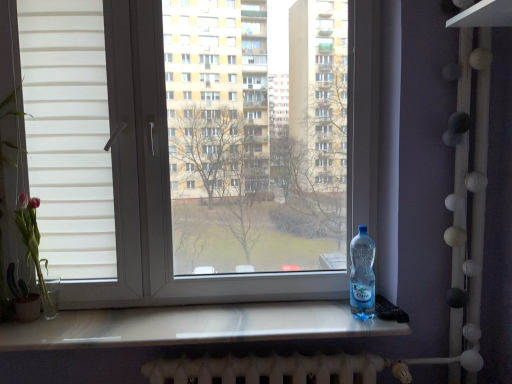
Identify the location of transparent plastic window at center. (161, 190).

This screenshot has width=512, height=384. What do you see at coordinates (362, 275) in the screenshot?
I see `transparent plastic bottle at right` at bounding box center [362, 275].

This screenshot has width=512, height=384. I want to click on pink glass vase at left, so click(35, 249).

Considering the points (367, 312) and (134, 214), which point is in front, point (367, 312) or point (134, 214)?

Positioned in front is point (367, 312).

From a real-world perspective, is transparent plastic bottle at right on transparent plastic window at center?

No.

Considering the relative positions of transparent plastic bottle at right and transparent plastic window at center in the image provided, is transparent plastic bottle at right to the left or to the right of transparent plastic window at center?

transparent plastic bottle at right is positioned on transparent plastic window at center's right side.

Would you consider transparent plastic window at center to be distant from transparent plastic bottle at right?

No, transparent plastic window at center is not far from transparent plastic bottle at right.

Between point (111, 56) and point (362, 233), which one is positioned behind?

The point (111, 56) is more distant.

Measure the distance from transparent plastic window at center to transparent plastic bottle at right.

transparent plastic window at center and transparent plastic bottle at right are 44.40 centimeters apart from each other.

Between transparent plastic window at center and transparent plastic bottle at right, which one has larger width?

transparent plastic bottle at right is wider.

Would you say pink glass vase at left is to the left or to the right of transparent plastic window at center in the picture?

From the image, it's evident that pink glass vase at left is to the left of transparent plastic window at center.

Consider the image. Is pink glass vase at left placed right next to transparent plastic window at center?

pink glass vase at left is not next to transparent plastic window at center, and they're not touching.

Considering the positions of point (47, 307) and point (123, 152), is point (47, 307) closer or farther from the camera than point (123, 152)?

Point (47, 307) is positioned farther from the camera compared to point (123, 152).

Between pink glass vase at left and transparent plastic window at center, which one has smaller width?

Thinner between the two is transparent plastic window at center.

How far apart are transparent plastic bottle at right and pink glass vase at left?

transparent plastic bottle at right is 3.87 feet from pink glass vase at left.

Which is more to the left, transparent plastic bottle at right or pink glass vase at left?

From the viewer's perspective, pink glass vase at left appears more on the left side.

Is transparent plastic bottle at right closer to camera compared to pink glass vase at left?

Yes, transparent plastic bottle at right is closer to the viewer.

Does pink glass vase at left turn towards transparent plastic bottle at right?

No, pink glass vase at left is not turned towards transparent plastic bottle at right.

Identify the location of bottle on the right of pink glass vase at left. Image resolution: width=512 pixels, height=384 pixels. (362, 275).

Looking at this image, from the image's perspective, is pink glass vase at left on top of transparent plastic bottle at right?

Yes, from the image's perspective, pink glass vase at left is above transparent plastic bottle at right.

Considering their positions, is pink glass vase at left located in front of or behind transparent plastic bottle at right?

pink glass vase at left is positioned farther from the viewer than transparent plastic bottle at right.

From the image's perspective, is transparent plastic window at center positioned above or below pink glass vase at left?

From the image's perspective, transparent plastic window at center appears above pink glass vase at left.

Is transparent plastic window at center taller or shorter than pink glass vase at left?

→ In the image, transparent plastic window at center appears to be taller than pink glass vase at left.

This screenshot has width=512, height=384. In order to click on window that is above the pink glass vase at left (from the image's perspective) in this screenshot , I will do `click(161, 190)`.

Is transparent plastic window at center aimed at pink glass vase at left?

Yes, transparent plastic window at center faces towards pink glass vase at left.

Locate an element on the screen. The image size is (512, 384). window in front of the transparent plastic bottle at right is located at coordinates (161, 190).

Locate an element on the screen. This screenshot has width=512, height=384. bottle below the transparent plastic window at center (from the image's perspective) is located at coordinates (362, 275).

Considering their positions, is transparent plastic bottle at right positioned closer to pink glass vase at left than transparent plastic window at center?

Among the two, transparent plastic window at center is located nearer to pink glass vase at left.

Based on their spatial positions, is transparent plastic window at center or transparent plastic bottle at right further from pink glass vase at left?

transparent plastic bottle at right lies further to pink glass vase at left than the other object.

Considering their positions, is pink glass vase at left positioned further to transparent plastic window at center than transparent plastic bottle at right?

pink glass vase at left is positioned further to the anchor transparent plastic window at center.

From the image, which object appears to be farther from transparent plastic bottle at right, transparent plastic window at center or pink glass vase at left?

The object further to transparent plastic bottle at right is pink glass vase at left.

Which object lies nearer to the anchor point transparent plastic bottle at right, pink glass vase at left or transparent plastic window at center?

The object closer to transparent plastic bottle at right is transparent plastic window at center.

In the scene shown: Considering their positions, is transparent plastic bottle at right positioned closer to transparent plastic window at center than pink glass vase at left?

transparent plastic bottle at right is closer to transparent plastic window at center.

You are a GUI agent. You are given a task and a screenshot of the screen. Output one action in this format:
    pyautogui.click(x=<x>, y=<y>)
    Task: Click on the window situated between pink glass vase at left and transparent plastic bottle at right from left to right
    Image resolution: width=512 pixels, height=384 pixels.
    Given the screenshot: What is the action you would take?
    161,190